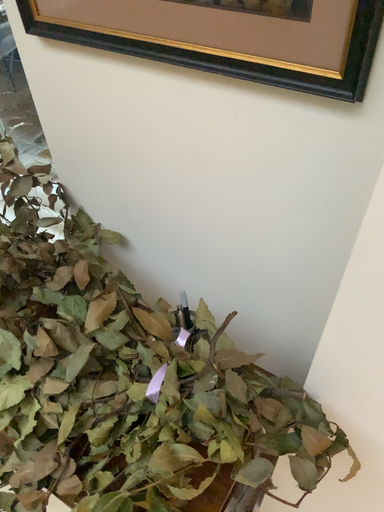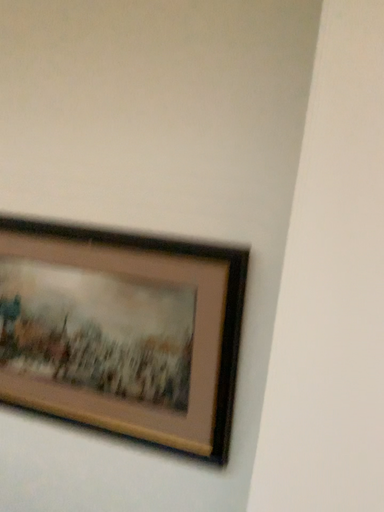
Question: Which way did the camera rotate in the video?

Choices:
 (A) rotated right
 (B) rotated left

Answer: (A)